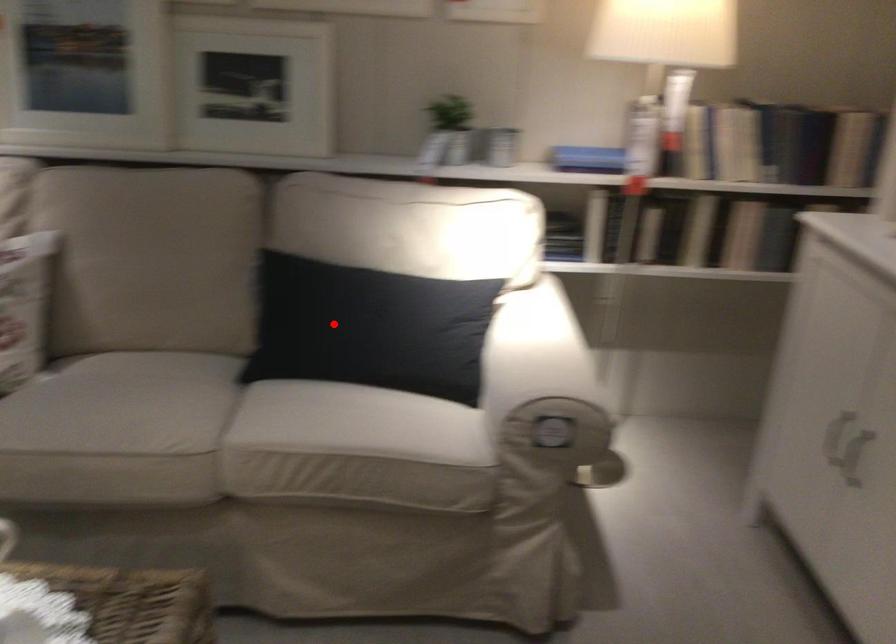
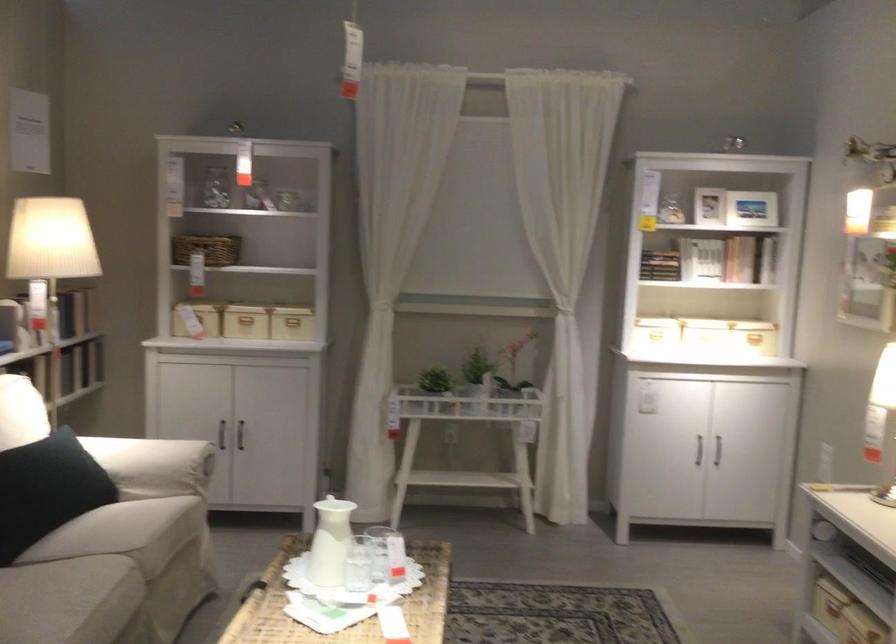
Locate, in the second image, the point that corresponds to the highlighted location in the first image.

(47, 489)